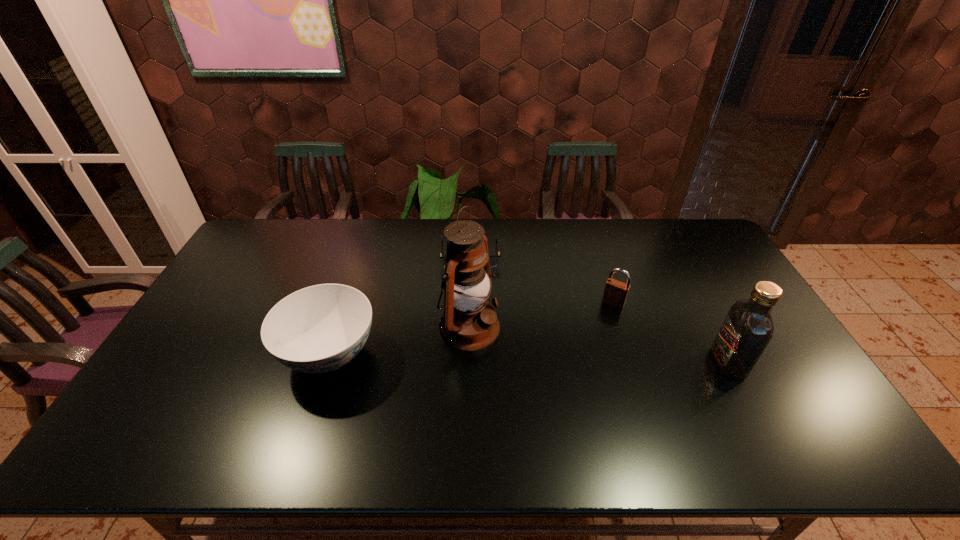
Where is `chinaware`? The height and width of the screenshot is (540, 960). chinaware is located at coordinates (317, 329).

Identify the location of the rightmost object. This screenshot has height=540, width=960. (747, 329).

The height and width of the screenshot is (540, 960). In order to click on vodka in this screenshot , I will do `click(747, 329)`.

Locate an element on the screen. This screenshot has width=960, height=540. the tallest object is located at coordinates (469, 322).

Identify the location of the shortest object. Image resolution: width=960 pixels, height=540 pixels. point(493,260).

Find the location of a particular element. the farthest object is located at coordinates (493, 260).

At what (x,y) coordinates should I click in order to perform the action: click on padlock. Please return your answer as a coordinate pair (x, y). The width and height of the screenshot is (960, 540). Looking at the image, I should click on (615, 294).

I want to click on vacant space located 0.190m on the right of the chinaware, so click(x=447, y=354).

I want to click on free space located on the front-facing side of the rightmost object, so click(x=636, y=362).

You are a GUI agent. You are given a task and a screenshot of the screen. Output one action in this format:
    pyautogui.click(x=<x>, y=<y>)
    Task: Click on the vacant point located 0.230m on the front-facing side of the rightmost object
    
    Given the screenshot: What is the action you would take?
    pyautogui.click(x=629, y=362)